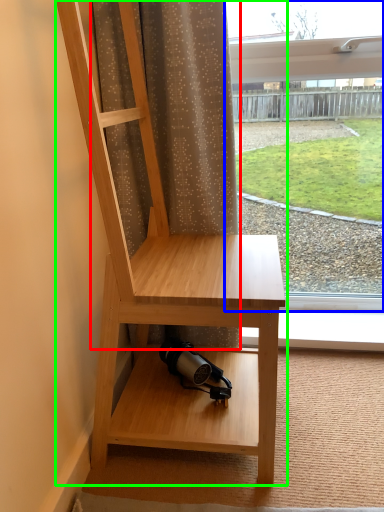
Question: Which object is the farthest from curtain (highlighted by a red box)? Choose among these: window (highlighted by a blue box) or furniture (highlighted by a green box).

Choices:
 (A) window
 (B) furniture

Answer: (A)